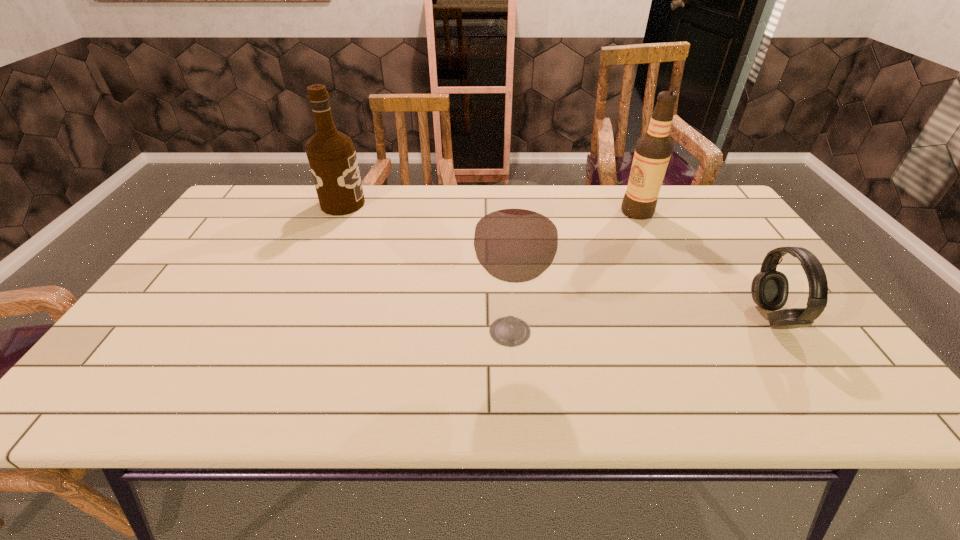
Locate an element on the screen. The image size is (960, 540). the closest alcohol relative to the headset is located at coordinates (653, 150).

At what (x,y) coordinates should I click in order to perform the action: click on vacant space that satisfies the following two spatial constraints: 1. on the label of the leftmost object; 2. on the back side of the nearest alcohol. Please return your answer as a coordinate pair (x, y). Image resolution: width=960 pixels, height=540 pixels. Looking at the image, I should click on (287, 332).

Where is `vacant area in the image that satisfies the following two spatial constraints: 1. on the label of the nearest alcohol; 2. on the right side of the leftmost alcohol`? The height and width of the screenshot is (540, 960). vacant area in the image that satisfies the following two spatial constraints: 1. on the label of the nearest alcohol; 2. on the right side of the leftmost alcohol is located at coordinates (287, 332).

Find the location of a particular element. Image resolution: width=960 pixels, height=540 pixels. vacant space that satisfies the following two spatial constraints: 1. on the label of the second alcohol from right to left; 2. on the left side of the leftmost object is located at coordinates (287, 332).

I want to click on vacant space that satisfies the following two spatial constraints: 1. on the label of the nearest alcohol; 2. on the right side of the leftmost object, so point(287,332).

This screenshot has height=540, width=960. In order to click on blank space that satisfies the following two spatial constraints: 1. on the label of the leftmost object; 2. on the right side of the second alcohol from left to right in this screenshot , I will do `click(287, 332)`.